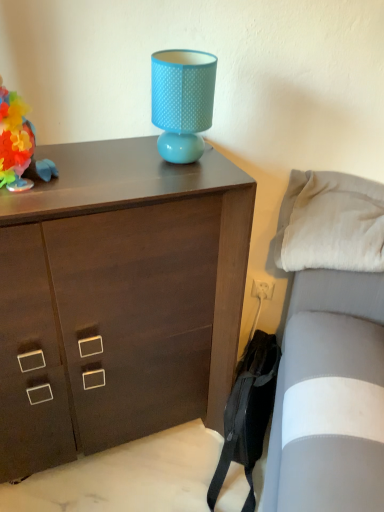
Question: Visually, is white soft pillow at right positioned to the left or to the right of matte blue lampshade at upper center?

Choices:
 (A) right
 (B) left

Answer: (A)

Question: In the image, is white soft pillow at right positioned in front of or behind matte blue lampshade at upper center?

Choices:
 (A) front
 (B) behind

Answer: (B)

Question: Which object is the closest to the multicolored paper flower at left?

Choices:
 (A) dark wood chest of drawers at upper center
 (B) white soft pillow at right
 (C) matte blue lampshade at upper center

Answer: (C)

Question: Which of these objects is positioned closest to the multicolored paper flower at left?

Choices:
 (A) matte blue lampshade at upper center
 (B) white soft pillow at right
 (C) dark wood chest of drawers at upper center

Answer: (A)